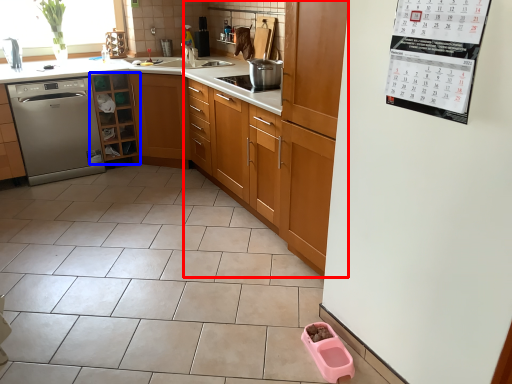
Question: Among these objects, which one is nearest to the camera, cabinetry (highlighted by a red box) or cabinetry (highlighted by a blue box)?

Choices:
 (A) cabinetry
 (B) cabinetry

Answer: (A)